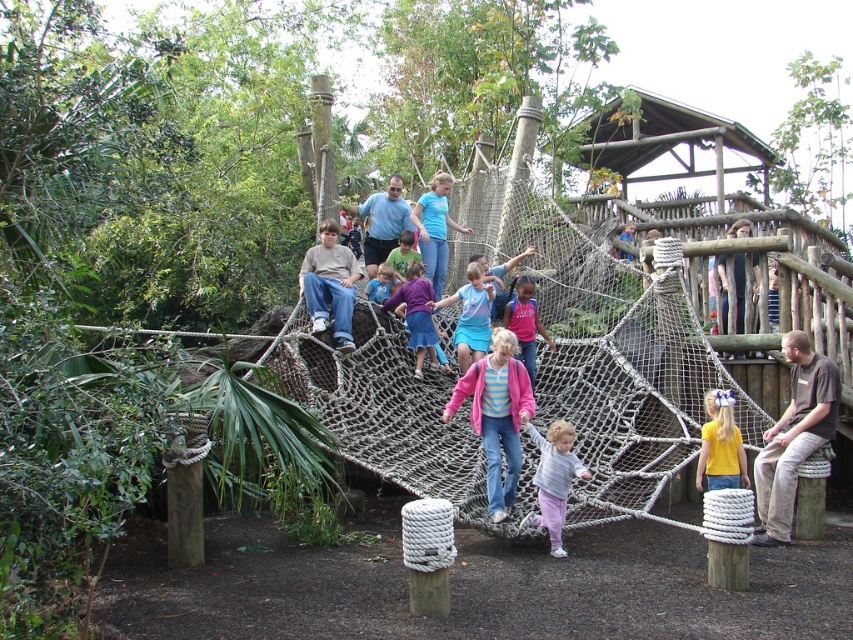
A group of tourists is walking across the rope bridge in the zoo. They are wearing different colored clothing. One tourist is wearing matte blue jeans at center. How far apart are the tourists?

The tourists are 41.19 meters apart.

You are a visitor at the zoo and want to take a photo of the matte blue jeans at center and the striped sweater at center from a distance. Can you fit both of them in the frame of your camera which has a maximum field of view of 60 feet?

The distance between the matte blue jeans at center and striped sweater at center is 61.51 feet, which exceeds the camera field of view of 60 feet. Therefore, you cannot fit both in the frame.

You are standing on the rope bridge in the zoo and want to move from the point at coordinates (447, 403) to the point at (506, 326). Which direction should you move to get closer to the wooden posts supporting the bridge?

To move from point (447, 403) to point (506, 326), you should move towards the point at (506, 326) because it is farther from the viewer, meaning it is likely closer to the wooden posts supporting the bridge.